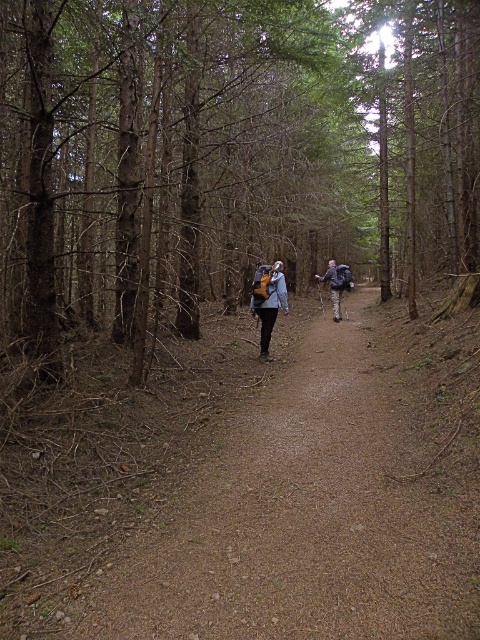
Which is in front, point (59, 45) or point (126, 630)?

Point (126, 630) is more forward.

Based on the photo, can you confirm if brown bark tree at center is shorter than dirt path at center?

In fact, brown bark tree at center may be taller than dirt path at center.

Does point (393, 3) lie in front of point (134, 620)?

No, it is not.

Where is `brown bark tree at center`? This screenshot has height=640, width=480. brown bark tree at center is located at coordinates (228, 156).

Which is below, brown bark tree at center or matte gray backpack at center?

matte gray backpack at center

Does brown bark tree at center have a lesser width compared to matte gray backpack at center?

In fact, brown bark tree at center might be wider than matte gray backpack at center.

The height and width of the screenshot is (640, 480). What do you see at coordinates (228, 156) in the screenshot? I see `brown bark tree at center` at bounding box center [228, 156].

At what (x,y) coordinates should I click in order to perform the action: click on brown bark tree at center. Please return your answer as a coordinate pair (x, y). This screenshot has width=480, height=640. Looking at the image, I should click on point(228,156).

Which is more to the left, dirt path at center or matte gray jacket at center?

matte gray jacket at center is more to the left.

Is dirt path at center above matte gray jacket at center?

Incorrect, dirt path at center is not positioned above matte gray jacket at center.

Find the location of a particular element. This screenshot has width=480, height=640. dirt path at center is located at coordinates point(323,499).